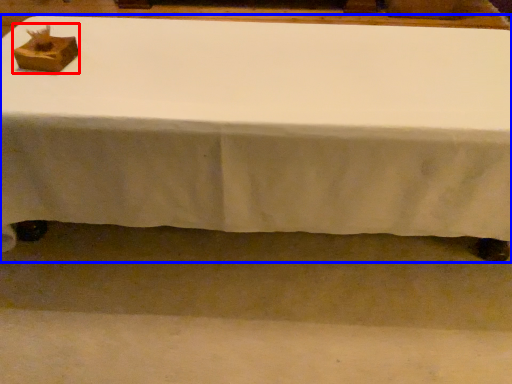
Question: Which object appears farthest to the camera in this image, shoe box (highlighted by a red box) or table (highlighted by a blue box)?

Choices:
 (A) shoe box
 (B) table

Answer: (A)